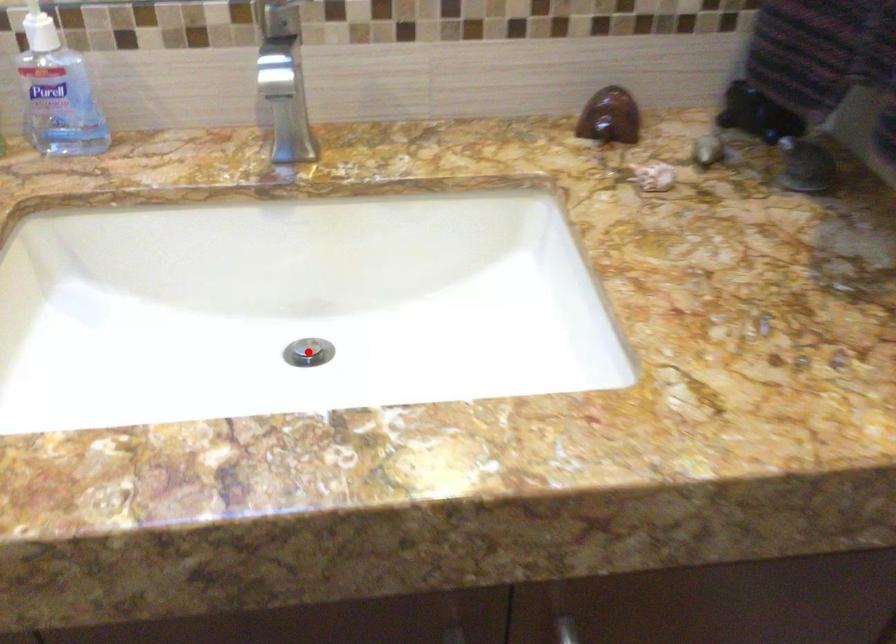
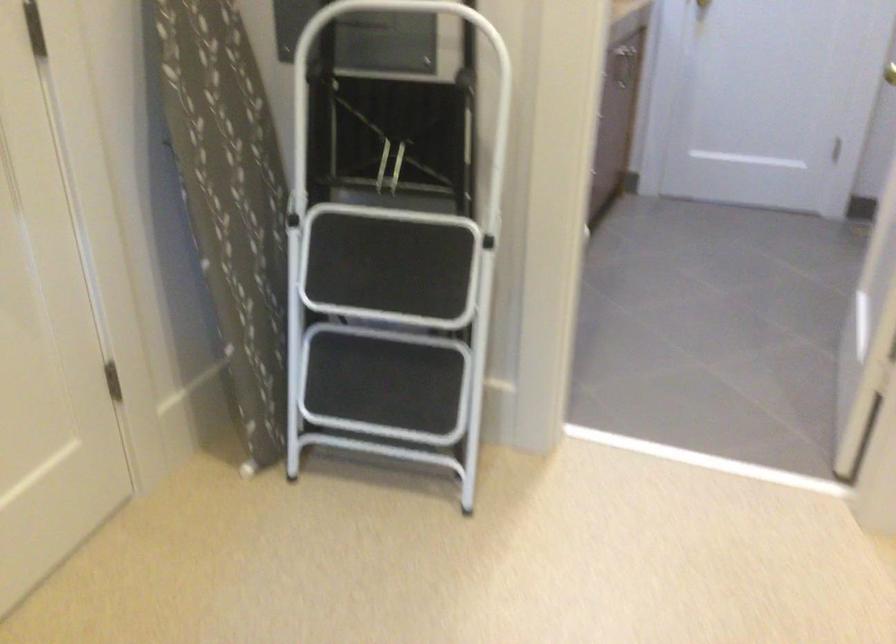
Question: I am providing you with two images of the same scene from different viewpoints. A red point is marked on the first image. At the location where the point appears in image 1, is it still visible in image 2?

Choices:
 (A) Yes
 (B) No

Answer: (B)